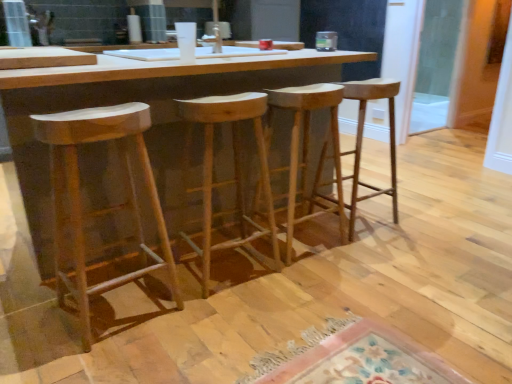
Where is `natural wood stool at left, which ranks as the fourth stool in right-to-left order`? The image size is (512, 384). natural wood stool at left, which ranks as the fourth stool in right-to-left order is located at coordinates (104, 208).

The width and height of the screenshot is (512, 384). Find the location of `natural wood stool at center, the 3th stool positioned from the left`. natural wood stool at center, the 3th stool positioned from the left is located at coordinates (306, 151).

In order to face natural wood table at center, should I rotate leftwards or rightwards?

To face it directly, rotate left by 8.266 degrees.

Locate an element on the screen. This screenshot has width=512, height=384. natural wood stool at left, which ranks as the fourth stool in right-to-left order is located at coordinates (104, 208).

Can you confirm if transparent glass door at right is shorter than natural wood stool at center, the 3th stool positioned from the left?

In fact, transparent glass door at right may be taller than natural wood stool at center, the 3th stool positioned from the left.

Is transparent glass door at right beside natural wood stool at center, the 3th stool positioned from the left?

No, transparent glass door at right is not next to natural wood stool at center, the 3th stool positioned from the left.

How different are the orientations of transparent glass door at right and natural wood stool at center, the 3th stool positioned from the left, in degrees?

179 degrees.

Does transparent glass door at right have a lesser width compared to natural wood stool at center, the 2th stool when ordered from right to left?

Correct, the width of transparent glass door at right is less than that of natural wood stool at center, the 2th stool when ordered from right to left.

From a real-world perspective, is transparent glass door at right on natural wood stool at left, which ranks as the fourth stool in right-to-left order?

Yes, from a real-world perspective, transparent glass door at right is on top of natural wood stool at left, which ranks as the fourth stool in right-to-left order.

Is transparent glass door at right aimed at natural wood stool at left, the 1th stool from the left?

No.

Is transparent glass door at right directly adjacent to natural wood stool at left, the 1th stool from the left?

They are not placed beside each other.

From a real-world perspective, which is physically below, natural wood stool at left, the 1th stool from the left, or natural wood stool at center, acting as the fourth stool starting from the left?

natural wood stool at center, acting as the fourth stool starting from the left.

Which object is further away from the camera taking this photo, natural wood stool at left, the 1th stool from the left, or natural wood stool at center, acting as the fourth stool starting from the left?

natural wood stool at center, acting as the fourth stool starting from the left, is further away from the camera.

Is point (93, 133) closer to camera compared to point (358, 166)?

Yes, it is in front of point (358, 166).

Is natural wood stool at left, the 1th stool from the left, at the left side of natural wood stool at center, the 1th stool in the right-to-left sequence?

Yes.

Looking at their sizes, would you say transparent glass door at right is wider or thinner than natural wood table at center?

Clearly, transparent glass door at right has less width compared to natural wood table at center.

This screenshot has width=512, height=384. In the image, there is a natural wood table at center. Find the location of `glass door above it (from the image's perspective)`. glass door above it (from the image's perspective) is located at coordinates [x=437, y=64].

Is point (442, 1) closer to camera compared to point (164, 65)?

No, it is not.

Considering the sizes of natural wood stool at center, the 3th stool positioned from the left, and natural wood stool at center, the second stool viewed from the left, in the image, is natural wood stool at center, the 3th stool positioned from the left, wider or thinner than natural wood stool at center, the second stool viewed from the left,?

natural wood stool at center, the 3th stool positioned from the left, is thinner than natural wood stool at center, the second stool viewed from the left.

Considering the sizes of natural wood stool at center, the 3th stool positioned from the left, and natural wood stool at center, which appears as the 3th stool when viewed from the right, in the image, is natural wood stool at center, the 3th stool positioned from the left, taller or shorter than natural wood stool at center, which appears as the 3th stool when viewed from the right,?

Clearly, natural wood stool at center, the 3th stool positioned from the left, is shorter compared to natural wood stool at center, which appears as the 3th stool when viewed from the right.

Which is less distant, (302, 96) or (220, 111)?

The point (220, 111) is more forward.

Who is smaller, natural wood stool at center, the 3th stool positioned from the left, or natural wood stool at center, the second stool viewed from the left?

Smaller between the two is natural wood stool at center, the 3th stool positioned from the left.

How far apart are natural wood stool at center, acting as the fourth stool starting from the left, and transparent glass door at right?

8.61 feet.

Is natural wood stool at center, the 1th stool in the right-to-left sequence, smaller than transparent glass door at right?

Incorrect, natural wood stool at center, the 1th stool in the right-to-left sequence, is not smaller in size than transparent glass door at right.

Which object is positioned more to the right, natural wood stool at center, the 1th stool in the right-to-left sequence, or transparent glass door at right?

From the viewer's perspective, transparent glass door at right appears more on the right side.

From a real-world perspective, which object stands above the other?

In real-world perspective, transparent glass door at right is above.

Locate an element on the screen. The width and height of the screenshot is (512, 384). glass door that appears above the natural wood stool at left, the 1th stool from the left (from the image's perspective) is located at coordinates (437, 64).

Is natural wood stool at left, which ranks as the fourth stool in right-to-left order, spatially inside transparent glass door at right, or outside of it?

natural wood stool at left, which ranks as the fourth stool in right-to-left order, exists outside the volume of transparent glass door at right.

Is natural wood stool at left, the 1th stool from the left, shorter than transparent glass door at right?

Yes.

From a real-world perspective, relative to transparent glass door at right, is natural wood stool at left, the 1th stool from the left, vertically above or below?

natural wood stool at left, the 1th stool from the left, is situated lower than transparent glass door at right in the real world.

From the image's perspective, starting from the transparent glass door at right, which stool is the 2nd one below? Please provide its 2D coordinates.

[(306, 151)]

The width and height of the screenshot is (512, 384). Identify the location of the 4th stool to the left when counting from the transparent glass door at right. (104, 208).

From the image, which object appears to be nearer to natural wood stool at center, the second stool viewed from the left, natural wood table at center or natural wood stool at center, the 3th stool positioned from the left?

natural wood stool at center, the 3th stool positioned from the left, is closer to natural wood stool at center, the second stool viewed from the left.

Based on their spatial positions, is natural wood stool at center, the 1th stool in the right-to-left sequence, or natural wood table at center closer to transparent glass door at right?

The object closer to transparent glass door at right is natural wood stool at center, the 1th stool in the right-to-left sequence.

Estimate the real-world distances between objects in this image. Which object is closer to transparent glass door at right, natural wood table at center or natural wood stool at center, acting as the fourth stool starting from the left?

The object closer to transparent glass door at right is natural wood stool at center, acting as the fourth stool starting from the left.

From the image, which object appears to be farther from natural wood stool at center, which appears as the 3th stool when viewed from the right, natural wood table at center or natural wood stool at left, which ranks as the fourth stool in right-to-left order?

natural wood table at center is positioned further to the anchor natural wood stool at center, which appears as the 3th stool when viewed from the right.

Estimate the real-world distances between objects in this image. Which object is further from natural wood stool at center, the 3th stool positioned from the left, natural wood stool at center, which appears as the 3th stool when viewed from the right, or natural wood stool at left, the 1th stool from the left?

Among the two, natural wood stool at left, the 1th stool from the left, is located further to natural wood stool at center, the 3th stool positioned from the left.

Estimate the real-world distances between objects in this image. Which object is further from transparent glass door at right, natural wood table at center or natural wood stool at left, the 1th stool from the left?

natural wood stool at left, the 1th stool from the left, is further to transparent glass door at right.

Based on their spatial positions, is natural wood stool at left, which ranks as the fourth stool in right-to-left order, or natural wood table at center closer to natural wood stool at center, the 2th stool when ordered from right to left?

natural wood table at center.

Based on the photo, estimate the real-world distances between objects in this image. Which object is further from natural wood stool at center, acting as the fourth stool starting from the left, natural wood table at center or natural wood stool at left, which ranks as the fourth stool in right-to-left order?

The object further to natural wood stool at center, acting as the fourth stool starting from the left, is natural wood stool at left, which ranks as the fourth stool in right-to-left order.

Find the location of a particular element. The image size is (512, 384). stool between natural wood stool at left, which ranks as the fourth stool in right-to-left order, and natural wood stool at center, the 3th stool positioned from the left is located at coordinates (234, 172).

Image resolution: width=512 pixels, height=384 pixels. In order to click on table positioned between natural wood stool at left, which ranks as the fourth stool in right-to-left order, and transparent glass door at right from near to far in this screenshot , I will do `click(133, 99)`.

Locate an element on the screen. This screenshot has height=384, width=512. table situated between natural wood stool at left, the 1th stool from the left, and natural wood stool at center, acting as the fourth stool starting from the left, from left to right is located at coordinates (133, 99).

Where is `stool located between natural wood table at center and natural wood stool at center, the 3th stool positioned from the left, in the left-right direction`? stool located between natural wood table at center and natural wood stool at center, the 3th stool positioned from the left, in the left-right direction is located at coordinates (234, 172).